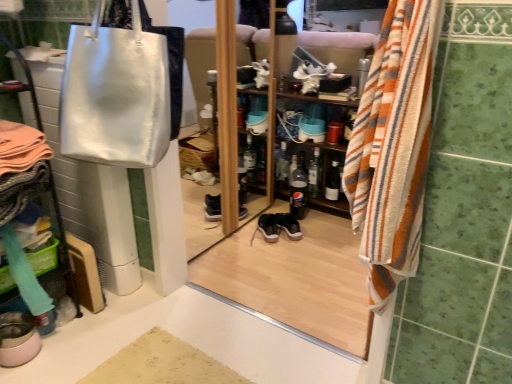
Locate an element on the screen. This screenshot has width=512, height=384. free space above beige textured bath mat at lower center (from a real-world perspective) is located at coordinates (160, 364).